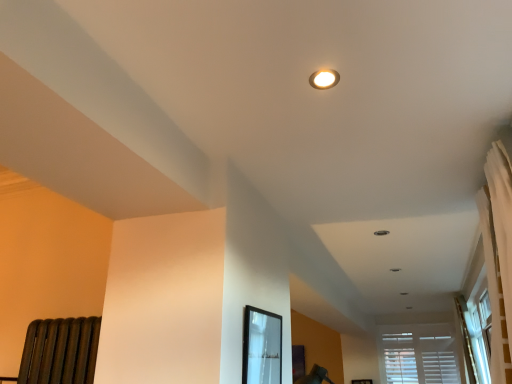
Question: From the image's perspective, is matte white light fixture at upper center over white wood blinds at lower right?

Choices:
 (A) no
 (B) yes

Answer: (B)

Question: From a real-world perspective, is matte white light fixture at upper center below white wood blinds at lower right?

Choices:
 (A) no
 (B) yes

Answer: (A)

Question: Does matte white light fixture at upper center come behind white wood blinds at lower right?

Choices:
 (A) yes
 (B) no

Answer: (B)

Question: From a real-world perspective, does matte white light fixture at upper center stand above white wood blinds at lower right?

Choices:
 (A) no
 (B) yes

Answer: (B)

Question: Can you confirm if matte white light fixture at upper center is wider than white wood blinds at lower right?

Choices:
 (A) no
 (B) yes

Answer: (B)

Question: Is the surface of matte white light fixture at upper center in direct contact with white wood blinds at lower right?

Choices:
 (A) yes
 (B) no

Answer: (B)

Question: Would you say matte white light fixture at upper center is part of white wood blinds at lower right's contents?

Choices:
 (A) no
 (B) yes

Answer: (A)

Question: Considering the relative sizes of white wood blinds at lower right and matte white light fixture at upper center in the image provided, is white wood blinds at lower right taller than matte white light fixture at upper center?

Choices:
 (A) yes
 (B) no

Answer: (A)

Question: Does white wood blinds at lower right have a smaller size compared to matte white light fixture at upper center?

Choices:
 (A) no
 (B) yes

Answer: (A)

Question: Does white wood blinds at lower right have a larger size compared to matte white light fixture at upper center?

Choices:
 (A) no
 (B) yes

Answer: (B)

Question: From a real-world perspective, does white wood blinds at lower right sit lower than matte white light fixture at upper center?

Choices:
 (A) no
 (B) yes

Answer: (B)

Question: Is matte white light fixture at upper center at the back of white wood blinds at lower right?

Choices:
 (A) no
 (B) yes

Answer: (A)

Question: Is matte black frame at center smaller than white wood blinds at lower right?

Choices:
 (A) no
 (B) yes

Answer: (B)